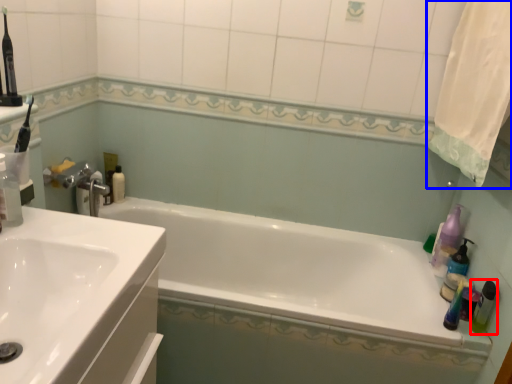
Question: Which of the following is the closest to the observer, bottle (highlighted by a red box) or shower curtain (highlighted by a blue box)?

Choices:
 (A) bottle
 (B) shower curtain

Answer: (B)